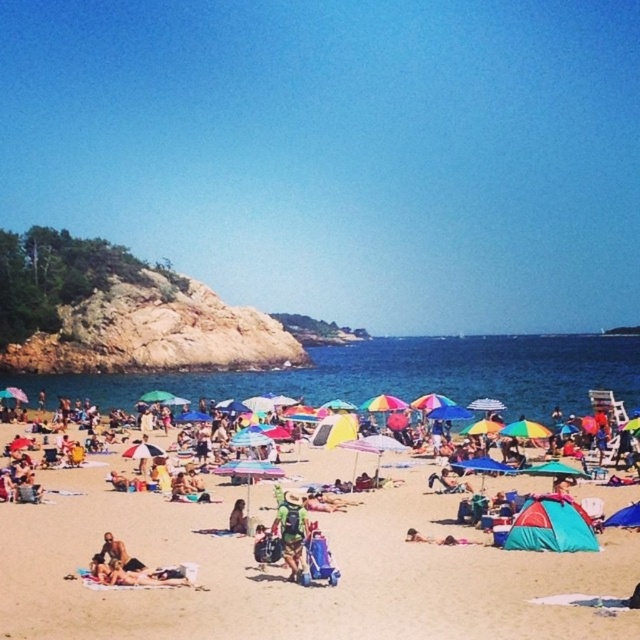
Looking at this image, which of these two, camouflage backpack at center or tan skin person at center, stands shorter?

Standing shorter between the two is tan skin person at center.

Is camouflage backpack at center shorter than tan skin person at center?

No, camouflage backpack at center is not shorter than tan skin person at center.

The width and height of the screenshot is (640, 640). What do you see at coordinates (291, 532) in the screenshot?
I see `camouflage backpack at center` at bounding box center [291, 532].

Find the location of a particular element. This screenshot has width=640, height=640. camouflage backpack at center is located at coordinates (291, 532).

Can you confirm if blue water at center is bigger than camouflage backpack at center?

Yes, blue water at center is bigger than camouflage backpack at center.

In the scene shown: Between blue water at center and camouflage backpack at center, which one is positioned lower?

blue water at center is below.

Who is more distant from viewer, (177, 381) or (282, 552)?

The point (177, 381) is behind.

At what (x,y) coordinates should I click in order to perform the action: click on blue water at center. Please return your answer as a coordinate pair (x, y). Looking at the image, I should click on (394, 374).

Who is lower down, beach umbrella at center or camouflage backpack at center?

Positioned lower is beach umbrella at center.

Does point (358, 563) lie in front of point (276, 524)?

That is True.

Find the location of `beach umbrella at center`. beach umbrella at center is located at coordinates (285, 572).